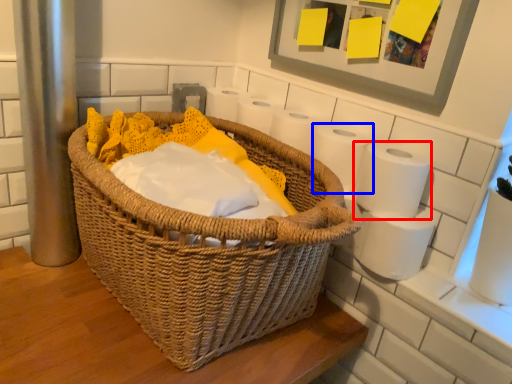
Question: Among these objects, which one is farthest to the camera, toilet paper (highlighted by a red box) or toilet paper (highlighted by a blue box)?

Choices:
 (A) toilet paper
 (B) toilet paper

Answer: (B)